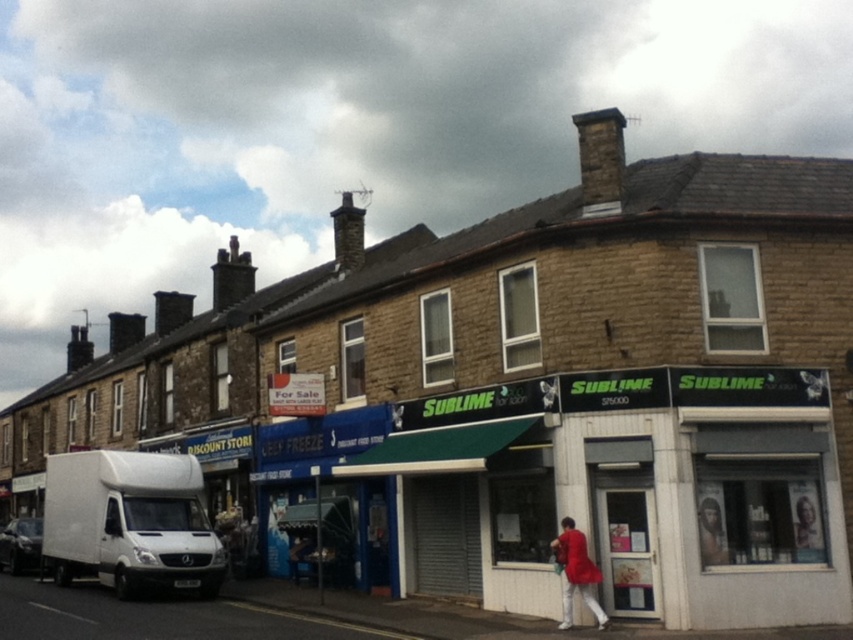
Question: Is white matte truck at lower left smaller than white matte van at lower left?

Choices:
 (A) yes
 (B) no

Answer: (B)

Question: Can you confirm if red fabric jacket at lower right is positioned to the right of smooth brown hair at center?

Choices:
 (A) no
 (B) yes

Answer: (A)

Question: Based on their relative distances, which object is nearer to the smooth brown hair at center?

Choices:
 (A) red fabric jacket at lower right
 (B) white matte van at lower left
 (C) white matte truck at lower left

Answer: (A)

Question: Can you confirm if red fabric jacket at lower right is smaller than white matte van at lower left?

Choices:
 (A) no
 (B) yes

Answer: (B)

Question: Which point is closer to the camera?

Choices:
 (A) white matte van at lower left
 (B) red fabric jacket at lower right
 (C) smooth brown hair at center

Answer: (B)

Question: Which point is farther from the camera taking this photo?

Choices:
 (A) (595, 600)
 (B) (33, 557)
 (C) (78, 540)

Answer: (B)